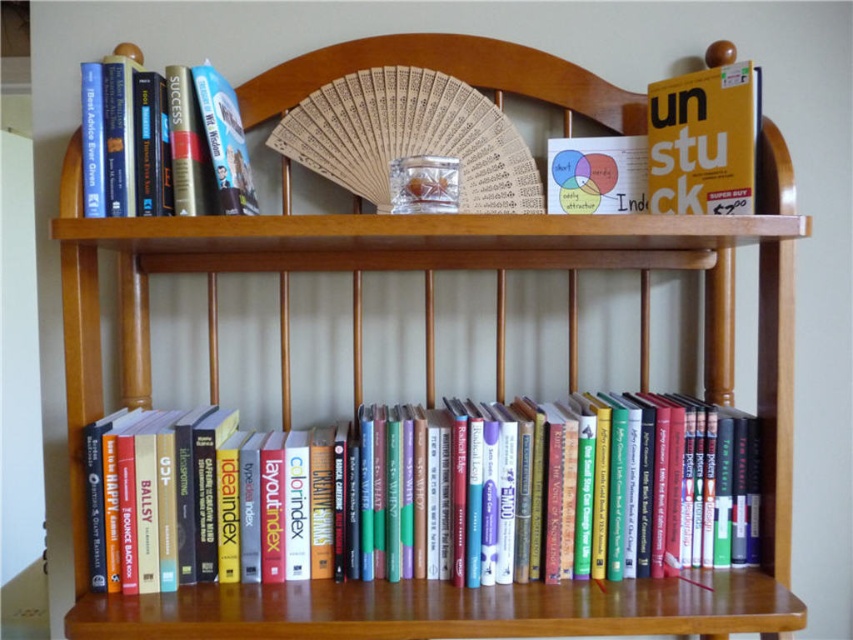
Consider the image. You are organizing a bookshelf and need to place a new book that is the same size as the matte yellow book at upper right. Which of the spaces between the hardcover books at lower center would be suitable for this new book?

The hardcover books at lower center are wider than the matte yellow book at upper right, so the spaces between the hardcover books at lower center are wider than the new book. Therefore, any of the spaces between the hardcover books at lower center would be suitable for placing the new book.

From the picture: You are organizing books on a shelf and see the hardcover book at upper left and the matte yellow book at upper right. Which book is located to the left of the other?

The hardcover book at upper left is positioned on the left side of matte yellow book at upper right.

You are organizing a bookshelf and want to place a new book between the hardcover books at lower center and the matte yellow book at upper right. Given that the new book is 15 inches thick, will there be enough space between them?

The hardcover books at lower center and the matte yellow book at upper right are 14.82 inches apart. Since the new book is 15 inches thick, it will not fit between them as the space is slightly smaller than the book.